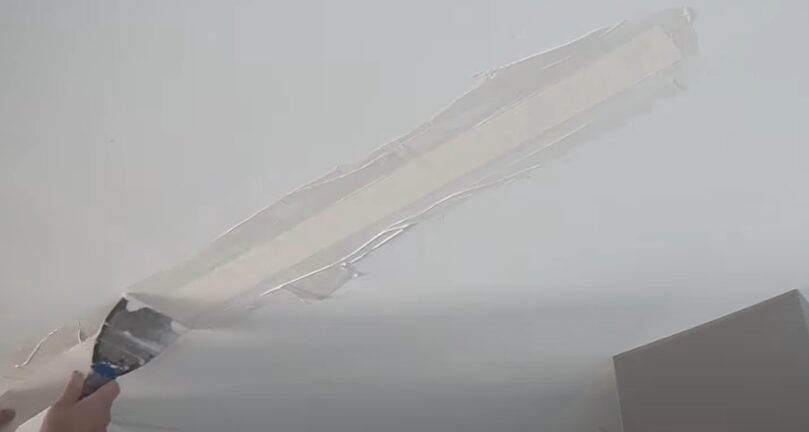
Where is `ceiling`? ceiling is located at coordinates (569, 235).